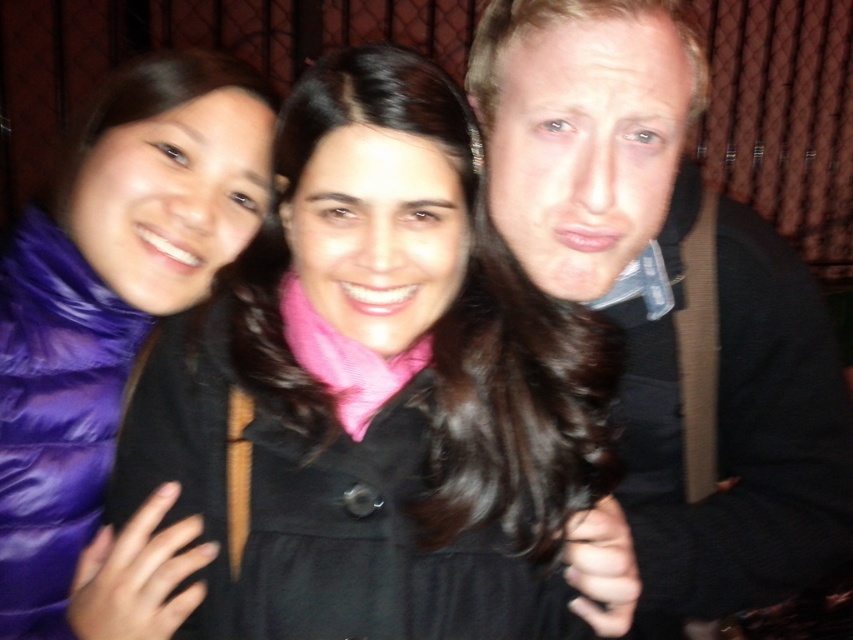
Question: Estimate the real-world distances between objects in this image. Which object is closer to the purple down jacket at left?

Choices:
 (A) smooth black shirt at center
 (B) matte black coat at center

Answer: (B)

Question: Which point is closer to the camera?

Choices:
 (A) smooth black shirt at center
 (B) purple down jacket at left
 (C) matte black coat at center

Answer: (C)

Question: Is matte black coat at center positioned in front of purple down jacket at left?

Choices:
 (A) no
 (B) yes

Answer: (B)

Question: Where is smooth black shirt at center located in relation to purple down jacket at left in the image?

Choices:
 (A) above
 (B) below

Answer: (B)

Question: From the image, what is the correct spatial relationship of matte black coat at center in relation to purple down jacket at left?

Choices:
 (A) right
 (B) left

Answer: (A)

Question: Considering the real-world distances, which object is closest to the matte black coat at center?

Choices:
 (A) smooth black shirt at center
 (B) purple down jacket at left

Answer: (A)